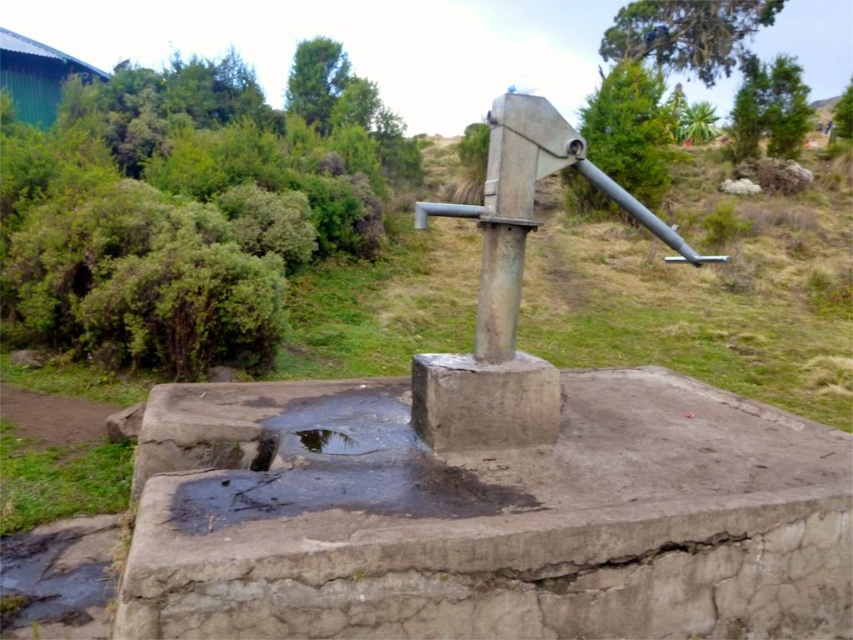
You are standing at the camera position and want to fill a 5.5 feet long garden hose with water from the gray concrete basin at center. Can you reach the basin with the hose without moving the hose or the basin?

The gray concrete basin at center is 6.38 feet away from camera, which is slightly longer than the 5.5 feet garden hose. Therefore, the hose cannot reach the basin without moving either the hose or the basin.

You are standing at the metal hand pump and want to walk to a specific location. There are two points marked in the image, point 1 at coordinates point (x=693, y=380) and point 2 at coordinates point (x=339, y=449). Which point should you walk towards if you want to move closer to the camera?

Point 2 at coordinates point (x=339, y=449) is closer to the camera, so you should walk towards point 2 at coordinates point (x=339, y=449) to move closer to the camera.

You are a gardener who needs to water plants using the pump. You see the gray concrete basin at center and the black glossy puddle at center. Which object is located higher in elevation?

The gray concrete basin at center is above the black glossy puddle at center, so the gray concrete basin at center is higher in elevation.